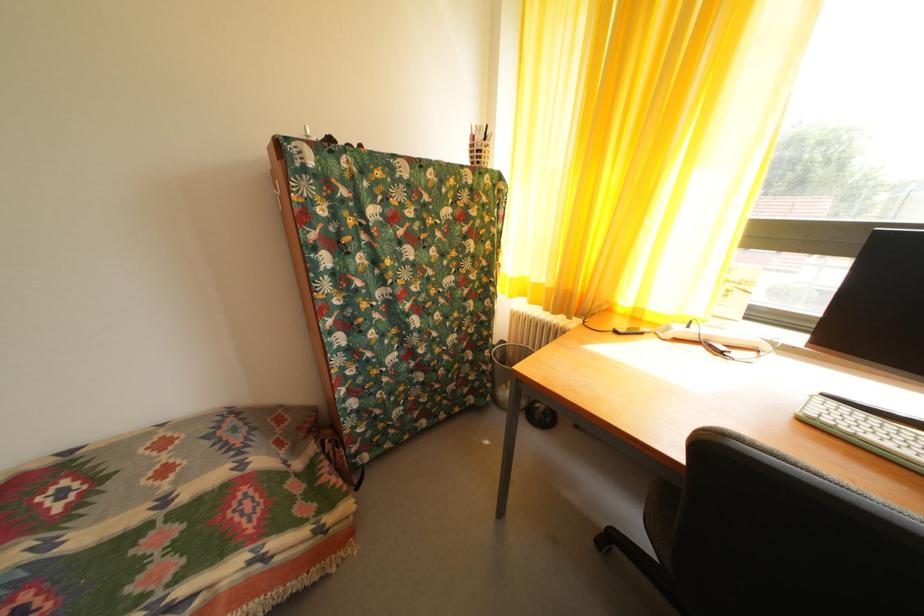
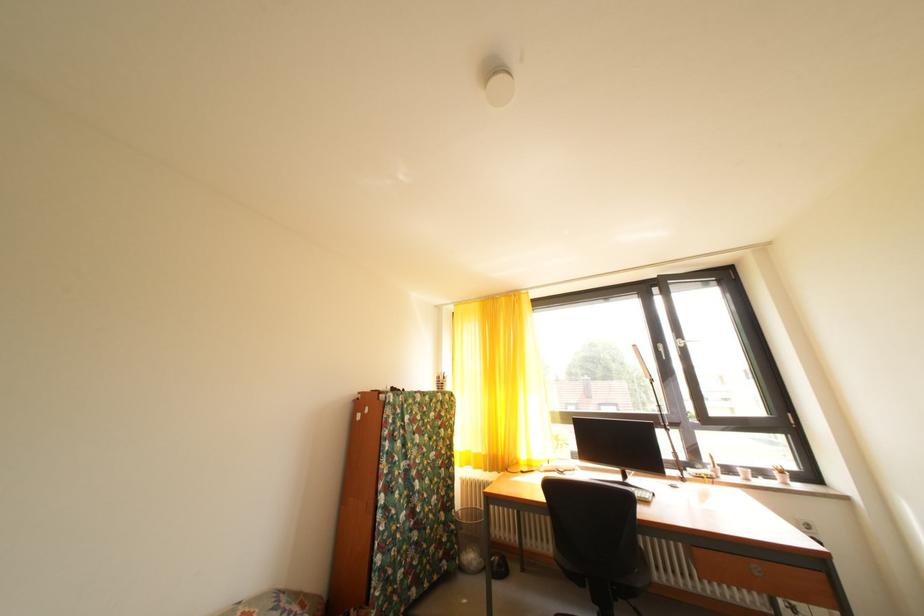
In the second image, find the point that corresponds to (x=493, y=373) in the first image.

(462, 533)